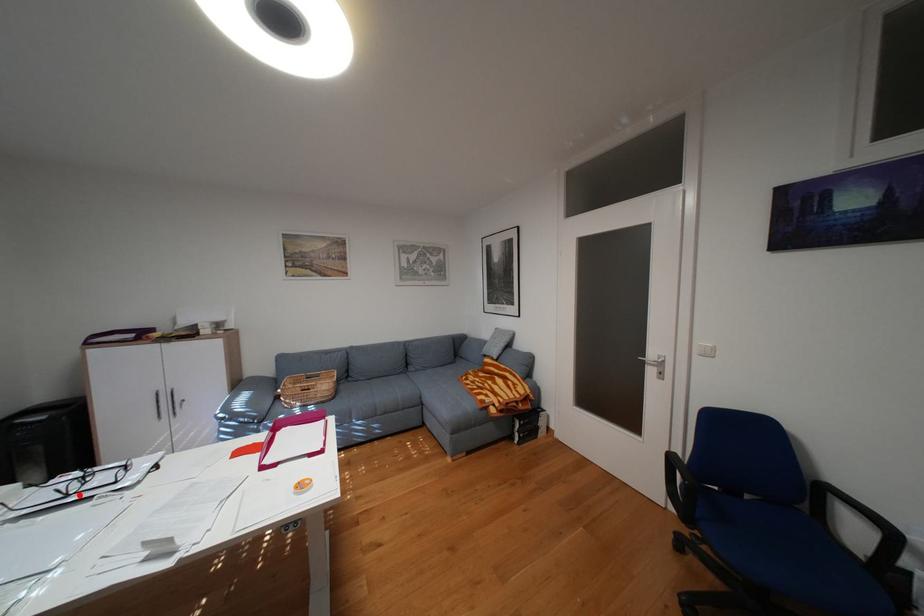
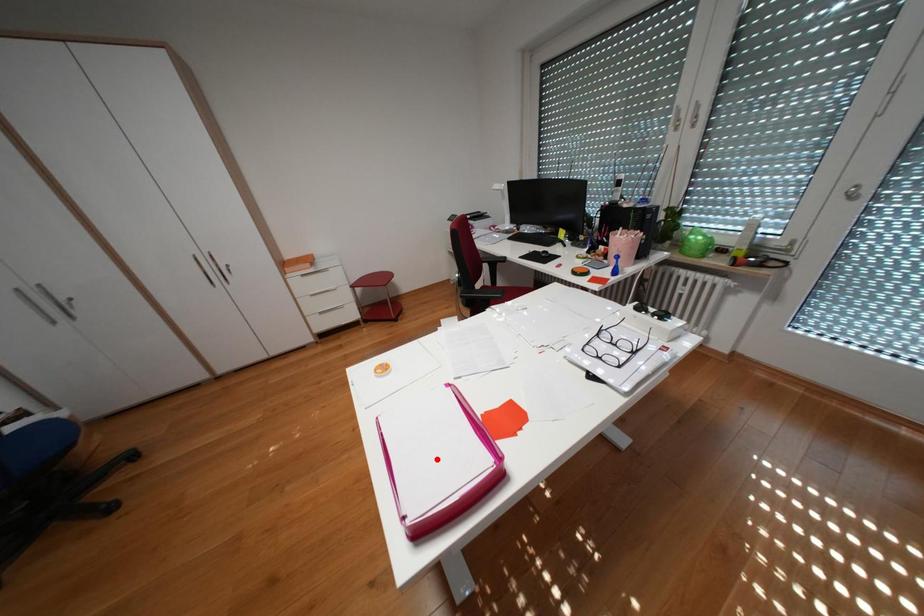
I am providing you with two images of the same scene from different viewpoints. A red point is marked on the first image and another point is marked on the second image. Does the point marked in image1 correspond to the same location as the one in image2?

No